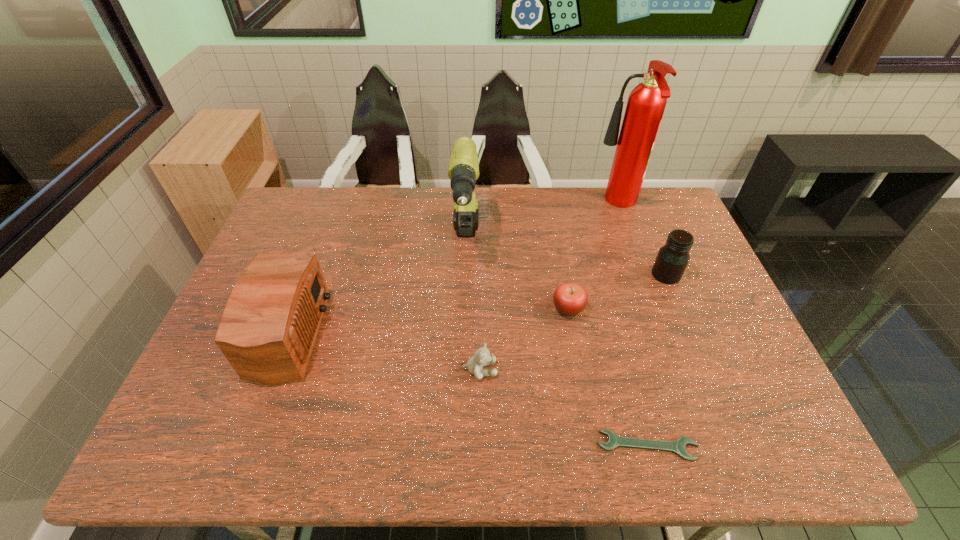
What are the coordinates of `the tallest object` in the screenshot? It's located at (646, 103).

Image resolution: width=960 pixels, height=540 pixels. I want to click on the sixth shortest object, so click(463, 171).

Identify the location of the third tallest object. (269, 325).

Locate an element on the screen. This screenshot has height=540, width=960. the leftmost object is located at coordinates (269, 325).

Locate an element on the screen. the fourth tallest object is located at coordinates (672, 259).

The height and width of the screenshot is (540, 960). What are the coordinates of `apple` in the screenshot? It's located at pyautogui.click(x=570, y=299).

At what (x,y) coordinates should I click in order to perform the action: click on teddy bear. Please return your answer as a coordinate pair (x, y). Looking at the image, I should click on (481, 357).

Find the location of `the nearest object`. the nearest object is located at coordinates (678, 446).

Identify the location of the shortest object. (678, 446).

The height and width of the screenshot is (540, 960). Find the location of `vacant area located at the nozzle of the tallest object`. vacant area located at the nozzle of the tallest object is located at coordinates (569, 205).